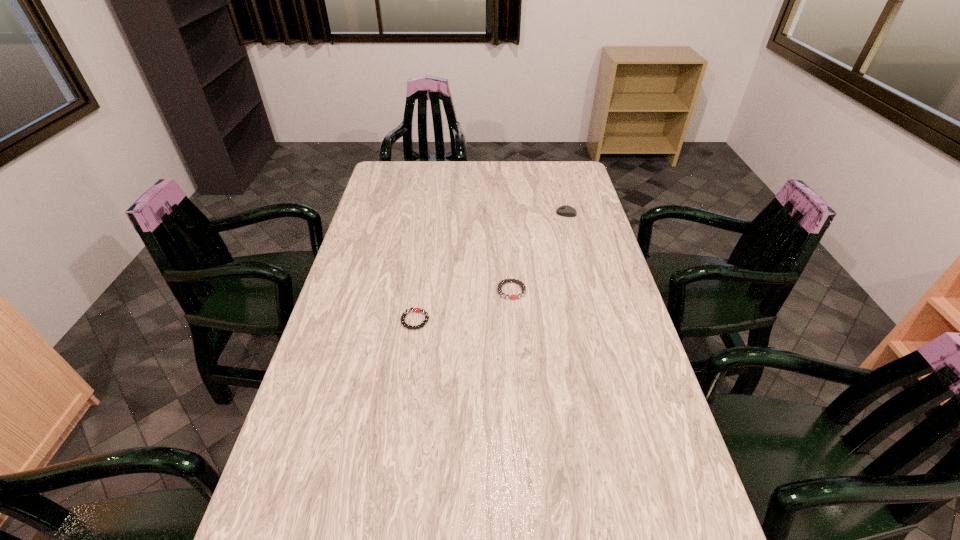
At what (x,y) coordinates should I click in order to perform the action: click on computer equipment. Please return your answer as a coordinate pair (x, y). The image size is (960, 540). Looking at the image, I should click on (567, 211).

The height and width of the screenshot is (540, 960). What are the coordinates of `the farthest object` in the screenshot? It's located at click(x=567, y=211).

This screenshot has width=960, height=540. Find the location of `the farther bracelet`. the farther bracelet is located at coordinates click(x=509, y=280).

You are a GUI agent. You are given a task and a screenshot of the screen. Output one action in this format:
    pyautogui.click(x=<x>, y=<y>)
    Task: Click on the right bracelet
    
    Given the screenshot: What is the action you would take?
    pyautogui.click(x=509, y=280)

Where is `the nearest object`? The width and height of the screenshot is (960, 540). the nearest object is located at coordinates (417, 310).

Find the location of a particular element. the leftmost object is located at coordinates (417, 310).

Identify the location of free space located on the front of the computer equipment. point(580,268).

Find the location of a particular element. free space located 0.310m on the right of the second object from right to left is located at coordinates (623, 291).

This screenshot has width=960, height=540. What are the coordinates of `vacant space situated 0.060m on the left of the left bracelet` in the screenshot? It's located at (381, 320).

The height and width of the screenshot is (540, 960). In order to click on object present at the right edge in this screenshot , I will do `click(567, 211)`.